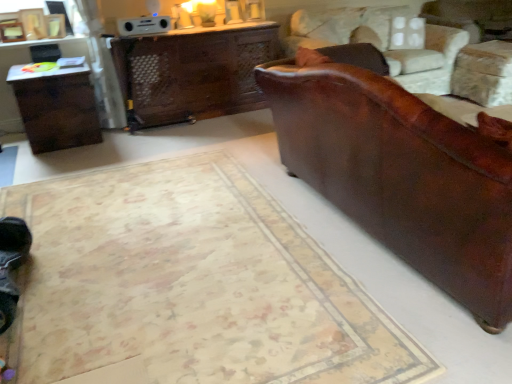
At what (x,y) coordinates should I click in order to perform the action: click on vacant space to the left of leather couch at right. Please return your answer as a coordinate pair (x, y). The height and width of the screenshot is (384, 512). Looking at the image, I should click on (182, 226).